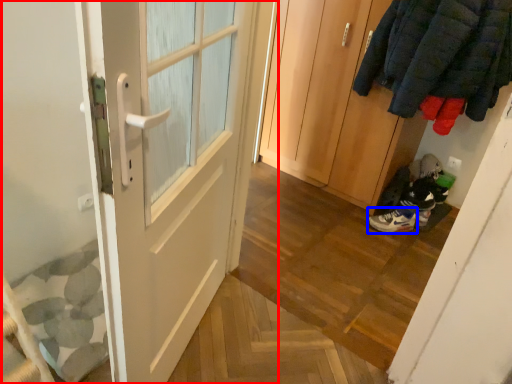
Question: Among these objects, which one is nearest to the camera, door (highlighted by a red box) or footwear (highlighted by a blue box)?

Choices:
 (A) door
 (B) footwear

Answer: (A)